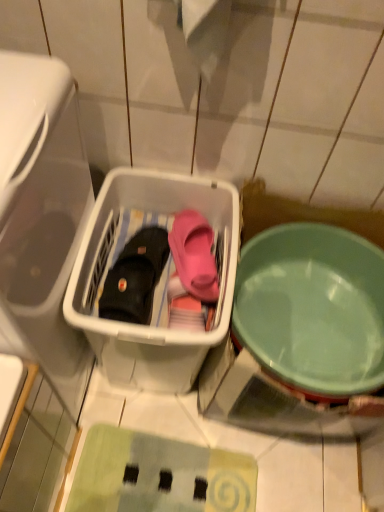
The image size is (384, 512). What do you see at coordinates (159, 281) in the screenshot?
I see `white plastic basket at center` at bounding box center [159, 281].

You are a GUI agent. You are given a task and a screenshot of the screen. Output one action in this format:
    pyautogui.click(x=<x>, y=<y>)
    Task: Click on the white plastic basket at center
    The image size is (384, 512).
    Given the screenshot: What is the action you would take?
    159,281

Identify the location of transparent plastic basket at left. (42, 219).

At what (x,y) coordinates should I click in order to perform the action: click on black leather boot at center. Please return your answer as a coordinate pair (x, y). Looking at the image, I should click on (135, 277).

At what (x,y) coordinates should I click in order to perform the action: click on light green plastic bowl at right. Please return your answer as a coordinate pair (x, y). Looking at the image, I should click on (313, 308).

Is white plastic basket at center far from light green plastic bowl at right?

No, white plastic basket at center is not far from light green plastic bowl at right.

Does point (94, 351) come in front of point (320, 355)?

Yes, it is.

Does white plastic basket at center have a larger size compared to light green plastic bowl at right?

Indeed, white plastic basket at center has a larger size compared to light green plastic bowl at right.

The height and width of the screenshot is (512, 384). Identify the location of bowl that is behind the white plastic basket at center. (313, 308).

Does white plastic basket at center have a lesser height compared to black leather boot at center?

In fact, white plastic basket at center may be taller than black leather boot at center.

Is white plastic basket at center with black leather boot at center?

white plastic basket at center and black leather boot at center are clearly separated.

Is point (140, 181) closer or farther from the camera than point (152, 302)?

Point (140, 181) is positioned farther from the camera compared to point (152, 302).

Is light green plastic bowl at right placed right next to transparent plastic basket at left?

They are not placed beside each other.

Considering the sizes of objects light green plastic bowl at right and transparent plastic basket at left in the image provided, who is thinner, light green plastic bowl at right or transparent plastic basket at left?

With smaller width is transparent plastic basket at left.

How much distance is there between light green plastic bowl at right and white plastic basket at center?

light green plastic bowl at right and white plastic basket at center are 10.57 inches apart.

How many degrees apart are the facing directions of light green plastic bowl at right and white plastic basket at center?

They differ by 0.000174 degrees in their facing directions.

Between light green plastic bowl at right and white plastic basket at center, which one has less height?

light green plastic bowl at right.

Considering the positions of points (315, 321) and (214, 228), is point (315, 321) closer to camera compared to point (214, 228)?

Yes, it is.

Is transparent plastic basket at left oriented towards light green plastic bowl at right?

Yes.

Can you confirm if transparent plastic basket at left is shorter than light green plastic bowl at right?

No.

Is point (48, 155) closer to viewer compared to point (381, 337)?

Yes.

Which object is positioned more to the left, transparent plastic basket at left or light green plastic bowl at right?

transparent plastic basket at left is more to the left.

In the scene shown: Is light green plastic bowl at right next to black leather boot at center and touching it?

No, light green plastic bowl at right is not beside black leather boot at center.

In the scene shown: Considering the relative sizes of light green plastic bowl at right and black leather boot at center in the image provided, is light green plastic bowl at right shorter than black leather boot at center?

No, light green plastic bowl at right is not shorter than black leather boot at center.

In the image, is light green plastic bowl at right positioned in front of or behind black leather boot at center?

Clearly, light green plastic bowl at right is in front of black leather boot at center.

Image resolution: width=384 pixels, height=512 pixels. I want to click on bowl on the right of black leather boot at center, so click(313, 308).

From a real-world perspective, is black leather boot at center positioned over white plastic basket at center based on gravity?

Yes, from a real-world perspective, black leather boot at center is above white plastic basket at center.

Considering the relative sizes of black leather boot at center and white plastic basket at center in the image provided, is black leather boot at center shorter than white plastic basket at center?

Yes, black leather boot at center is shorter than white plastic basket at center.

Is black leather boot at center next to white plastic basket at center?

No, black leather boot at center is not beside white plastic basket at center.

Can we say black leather boot at center lies outside white plastic basket at center?

That's incorrect, black leather boot at center is not completely outside white plastic basket at center.

Where is `bowl to the right of white plastic basket at center`? The width and height of the screenshot is (384, 512). bowl to the right of white plastic basket at center is located at coordinates (313, 308).

Where is `footwear behind the white plastic basket at center`? footwear behind the white plastic basket at center is located at coordinates (135, 277).

Estimate the real-world distances between objects in this image. Which object is further from light green plastic bowl at right, white plastic basket at center or black leather boot at center?

Among the two, black leather boot at center is located further to light green plastic bowl at right.

Based on their spatial positions, is transparent plastic basket at left or light green plastic bowl at right closer to white plastic basket at center?

transparent plastic basket at left is closer to white plastic basket at center.

From the image, which object appears to be farther from transparent plastic basket at left, light green plastic bowl at right or black leather boot at center?

Among the two, light green plastic bowl at right is located further to transparent plastic basket at left.

Based on their spatial positions, is white plastic basket at center or light green plastic bowl at right closer to transparent plastic basket at left?

white plastic basket at center.

From the picture: Considering their positions, is transparent plastic basket at left positioned closer to black leather boot at center than white plastic basket at center?

white plastic basket at center lies closer to black leather boot at center than the other object.

Based on their spatial positions, is transparent plastic basket at left or black leather boot at center further from light green plastic bowl at right?

Based on the image, transparent plastic basket at left appears to be further to light green plastic bowl at right.

From the image, which object appears to be nearer to black leather boot at center, light green plastic bowl at right or white plastic basket at center?

white plastic basket at center.

Estimate the real-world distances between objects in this image. Which object is further from white plastic basket at center, transparent plastic basket at left or black leather boot at center?

transparent plastic basket at left is positioned further to the anchor white plastic basket at center.

Where is `storage box situated between black leather boot at center and light green plastic bowl at right from left to right`? storage box situated between black leather boot at center and light green plastic bowl at right from left to right is located at coordinates (159, 281).

Find the location of a particular element. storage box located between transparent plastic basket at left and light green plastic bowl at right in the left-right direction is located at coordinates (159, 281).

Identify the location of storage box between transparent plastic basket at left and black leather boot at center along the z-axis. Image resolution: width=384 pixels, height=512 pixels. (159, 281).

Image resolution: width=384 pixels, height=512 pixels. What are the coordinates of `footwear between transparent plastic basket at left and light green plastic bowl at right in the horizontal direction` in the screenshot? It's located at (135, 277).